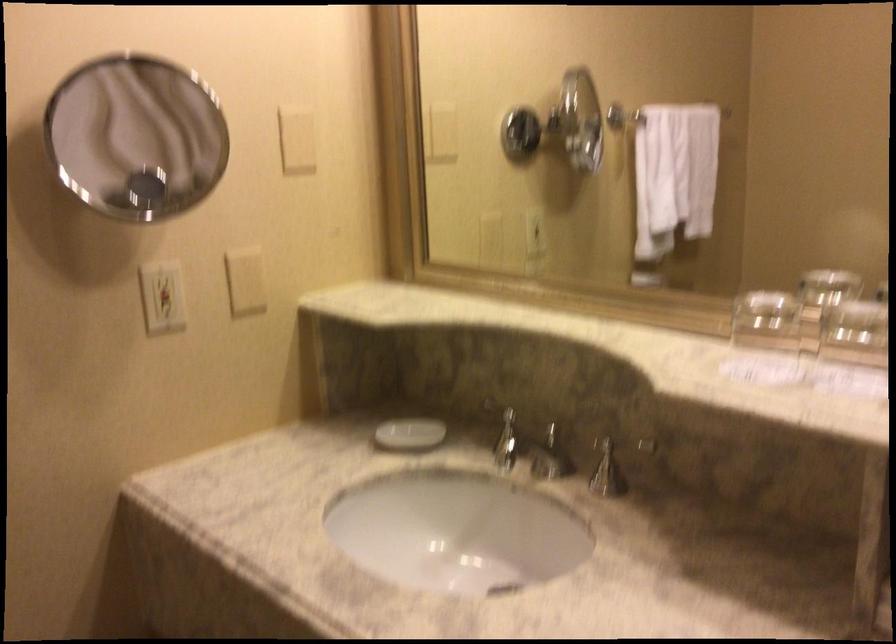
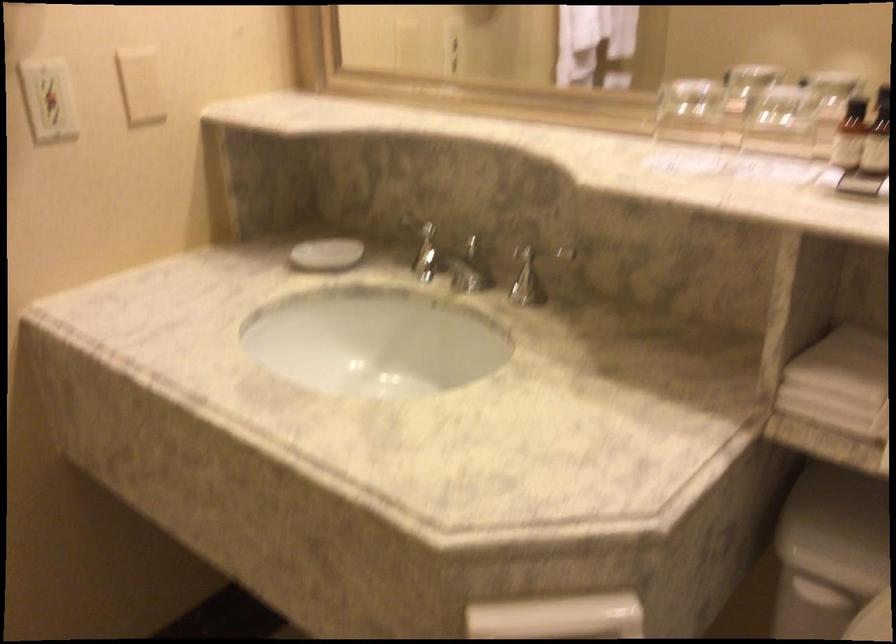
The point at (411,431) is marked in the first image. Where is the corresponding point in the second image?

(325, 254)